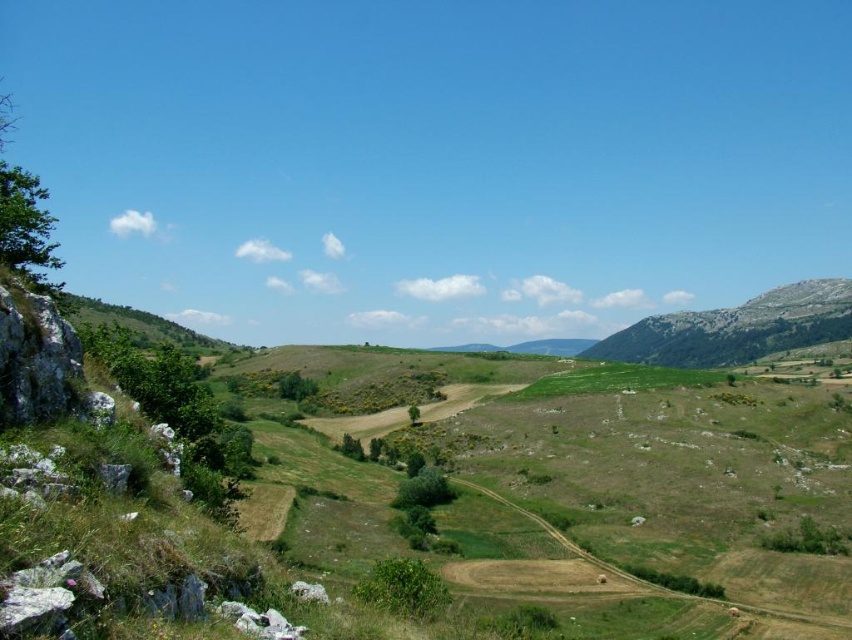
Question: Does green grassy field at center have a larger size compared to green grassy mountain at right?

Choices:
 (A) no
 (B) yes

Answer: (A)

Question: Is green grassy field at center further to camera compared to green grassy mountain at right?

Choices:
 (A) no
 (B) yes

Answer: (A)

Question: Which point is farther from the camera taking this photo?

Choices:
 (A) (715, 333)
 (B) (10, 417)

Answer: (A)

Question: Does green grassy field at center have a greater width compared to green grassy mountain at right?

Choices:
 (A) yes
 (B) no

Answer: (B)